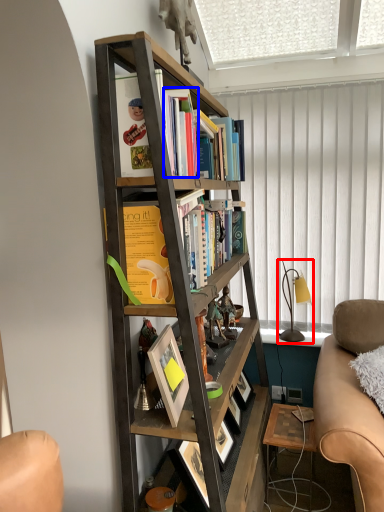
Question: Which point is further to the camera, table lamp (highlighted by a red box) or book (highlighted by a blue box)?

Choices:
 (A) table lamp
 (B) book

Answer: (A)